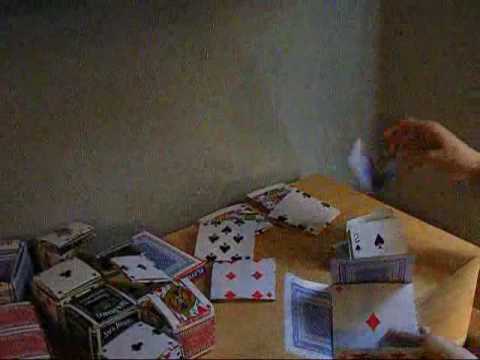
Find the location of a particular element. The width and height of the screenshot is (480, 360). table is located at coordinates (435, 256).